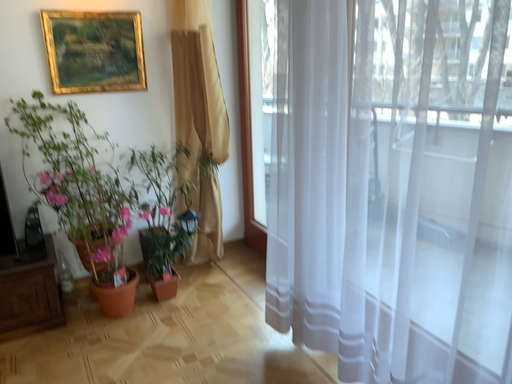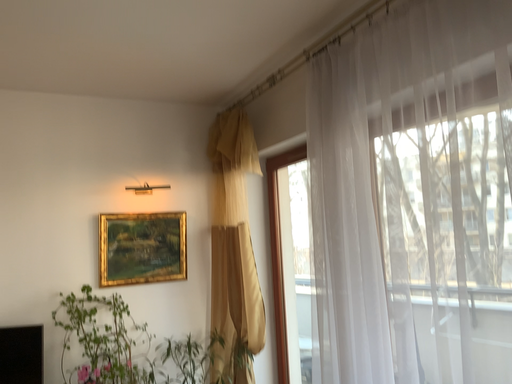
Question: How did the camera likely rotate when shooting the video?

Choices:
 (A) rotated upward
 (B) rotated downward

Answer: (A)